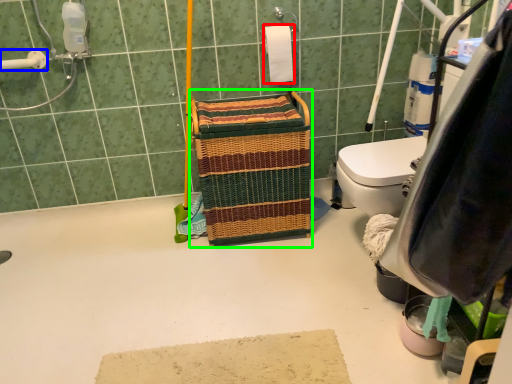
Question: Which object is positioned closest to toilet paper (highlighted by a red box)? Select from shower (highlighted by a blue box) and laundry basket (highlighted by a green box).

Choices:
 (A) shower
 (B) laundry basket

Answer: (B)